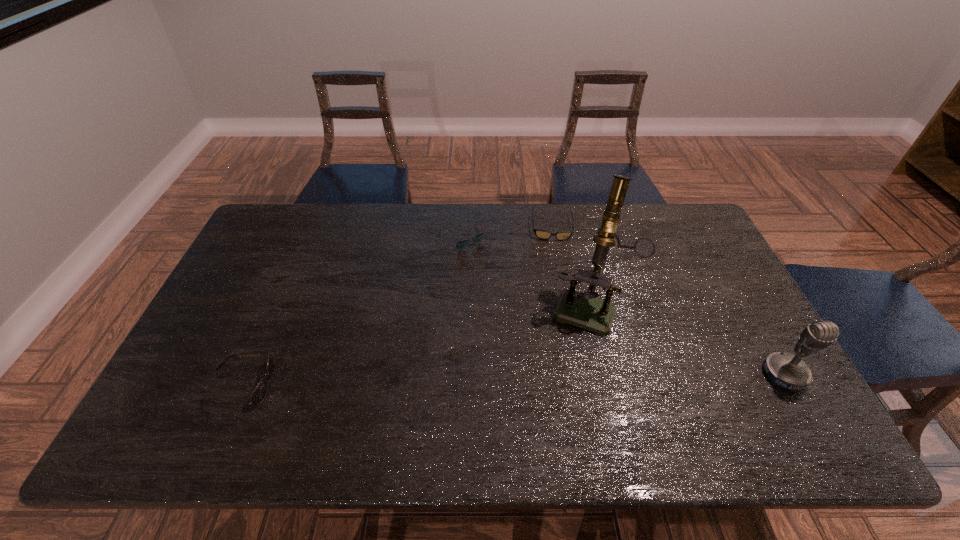
Where is `vacant space on the desktop that is between the tallest sunglasses and the microphone and is positioned on the lenses of the second object from left to right`? The width and height of the screenshot is (960, 540). vacant space on the desktop that is between the tallest sunglasses and the microphone and is positioned on the lenses of the second object from left to right is located at coordinates (579, 378).

Locate an element on the screen. vacant space on the desktop that is between the nearest sunglasses and the fourth shortest object and is positioned at the eyepiece of the tallest object is located at coordinates coord(564,379).

Locate an element on the screen. The image size is (960, 540). free space on the desktop that is between the leftmost object and the second tallest object and is positioned on the front-facing side of the rightmost sunglasses is located at coordinates (562, 379).